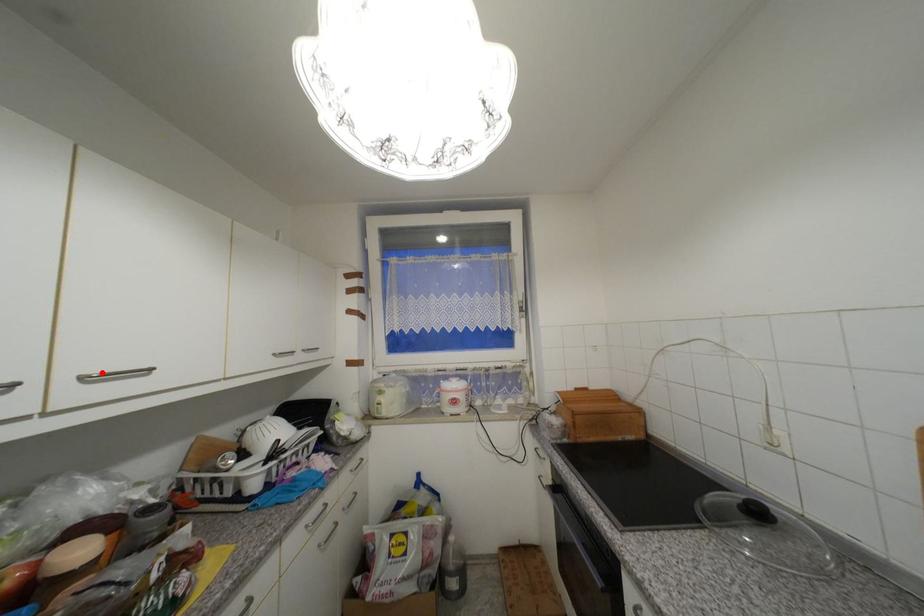
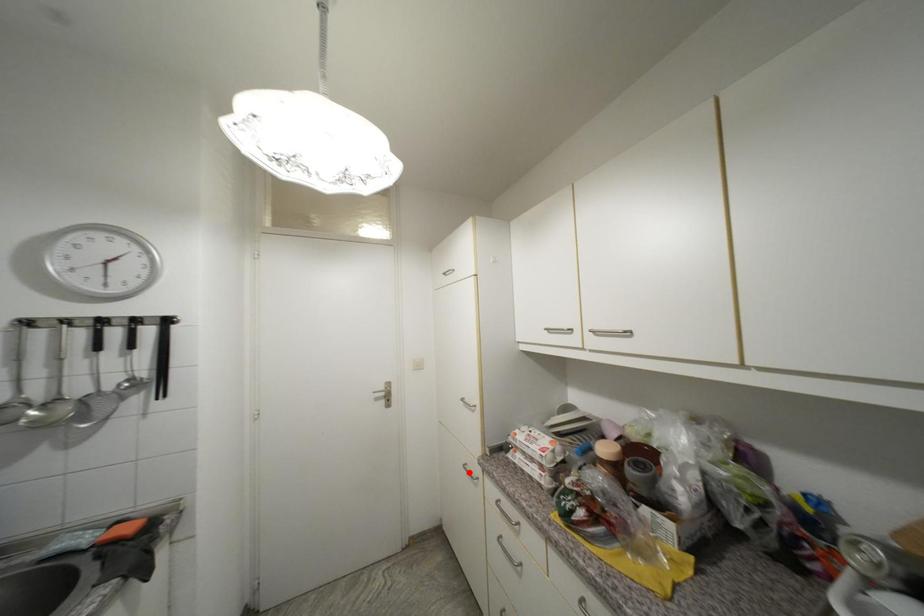
I am providing you with two images of the same scene from different viewpoints. A red point is marked on the first image and another point is marked on the second image. Is the red point in image1 aligned with the point shown in image2?

No